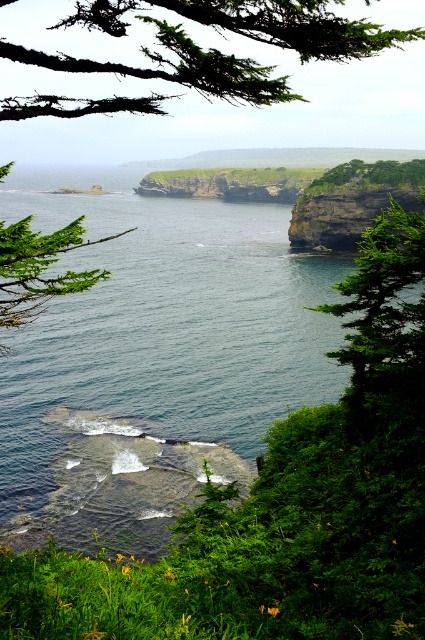
Question: Where is green water at center located in relation to dark gray rock cliff at upper right in the image?

Choices:
 (A) left
 (B) right

Answer: (A)

Question: Is green mossy branch at upper left above green leafy tree at upper center?

Choices:
 (A) no
 (B) yes

Answer: (B)

Question: Does green leafy tree at right lie in front of green leafy tree at upper center?

Choices:
 (A) yes
 (B) no

Answer: (A)

Question: Which of the following is the farthest from the observer?

Choices:
 (A) (223, 301)
 (B) (124, 109)

Answer: (B)

Question: Which object is closer to the camera taking this photo?

Choices:
 (A) green leafy tree at upper center
 (B) green mossy branch at upper left

Answer: (B)

Question: Which of the following is the farthest from the observer?

Choices:
 (A) (408, 163)
 (B) (408, 323)
 (C) (99, 22)

Answer: (A)